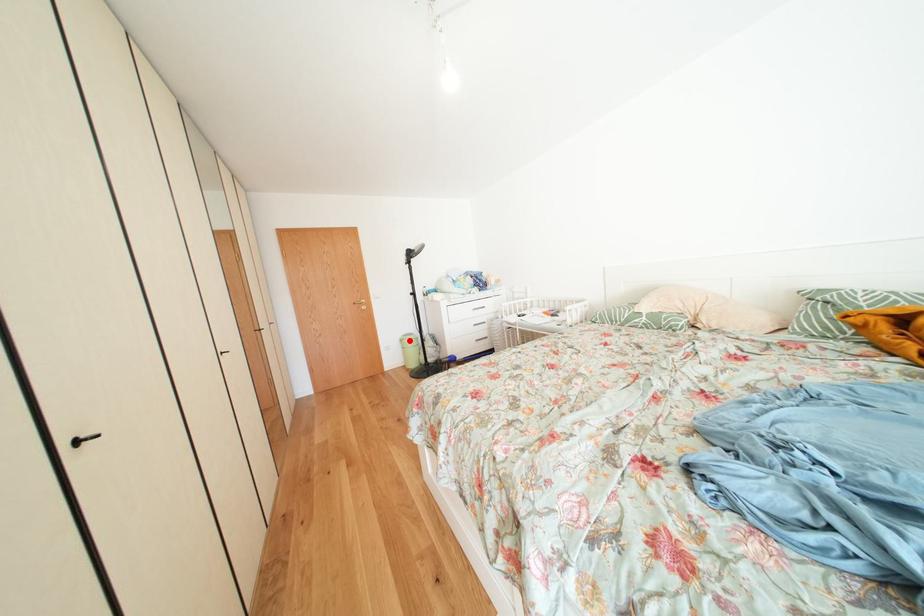
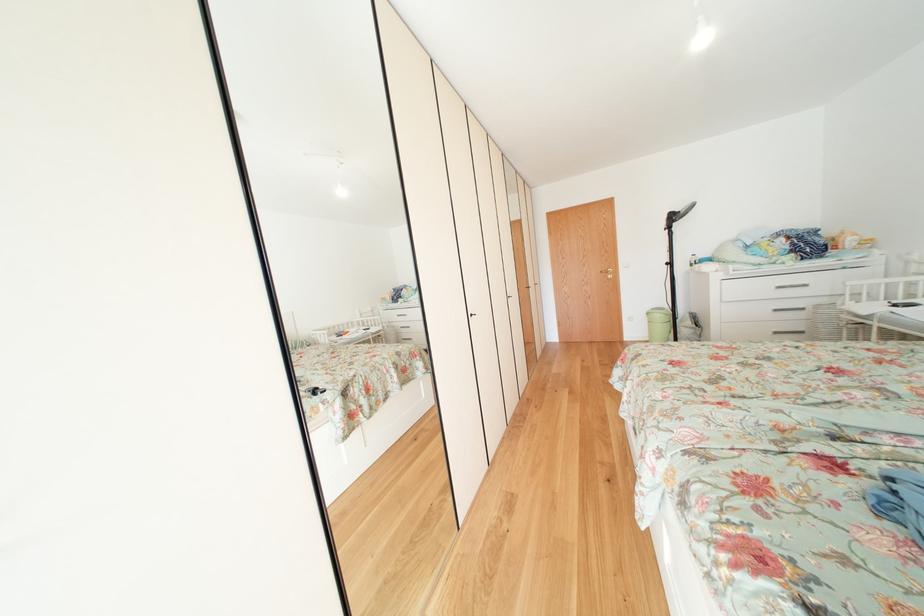
In the second image, find the point that corresponds to the highlighted location in the first image.

(657, 314)